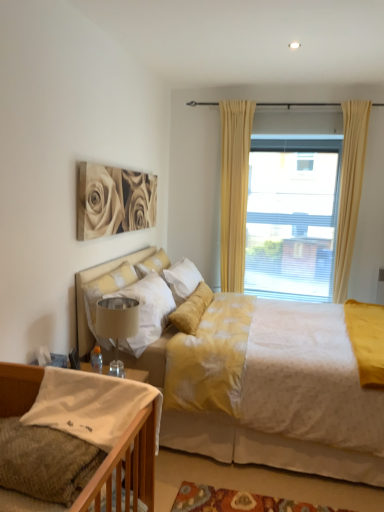
Question: Is the position of white textured bed at center, placed as the 2th bed when sorted from front to back, more distant than that of knitted fabric bed at lower left, the 1th bed when ordered from front to back?

Choices:
 (A) no
 (B) yes

Answer: (B)

Question: Is white textured bed at center, marked as the first bed in a back-to-front arrangement, facing away from knitted fabric bed at lower left, acting as the 2th bed starting from the back?

Choices:
 (A) no
 (B) yes

Answer: (A)

Question: Does white textured bed at center, placed as the 2th bed when sorted from front to back, appear on the right side of knitted fabric bed at lower left, acting as the 2th bed starting from the back?

Choices:
 (A) no
 (B) yes

Answer: (B)

Question: Is white textured bed at center, marked as the first bed in a back-to-front arrangement, facing towards knitted fabric bed at lower left, acting as the 2th bed starting from the back?

Choices:
 (A) yes
 (B) no

Answer: (B)

Question: Is knitted fabric bed at lower left, acting as the 2th bed starting from the back, located within white textured bed at center, placed as the 2th bed when sorted from front to back?

Choices:
 (A) no
 (B) yes

Answer: (A)

Question: Can you confirm if white textured bed at center, marked as the first bed in a back-to-front arrangement, is thinner than knitted fabric bed at lower left, the 1th bed when ordered from front to back?

Choices:
 (A) no
 (B) yes

Answer: (A)

Question: From the image's perspective, is translucent glass window at upper center on white soft pillow at upper left, which is the 2th pillow in front-to-back order?

Choices:
 (A) no
 (B) yes

Answer: (B)

Question: Is translucent glass window at upper center not within white soft pillow at upper left, the 2th pillow viewed from the back?

Choices:
 (A) no
 (B) yes

Answer: (B)

Question: Can you confirm if translucent glass window at upper center is thinner than white soft pillow at upper left, the 2th pillow viewed from the back?

Choices:
 (A) yes
 (B) no

Answer: (A)

Question: Is the surface of translucent glass window at upper center in direct contact with white soft pillow at upper left, the 2th pillow viewed from the back?

Choices:
 (A) yes
 (B) no

Answer: (B)

Question: Can you confirm if translucent glass window at upper center is taller than white soft pillow at upper left, which is the second pillow in bottom-to-top order?

Choices:
 (A) yes
 (B) no

Answer: (A)

Question: Can you confirm if translucent glass window at upper center is positioned to the right of white soft pillow at upper left, the 2th pillow viewed from the back?

Choices:
 (A) no
 (B) yes

Answer: (B)

Question: Is white cotton pillow at lower left, which is the 1th pillow from front to back, facing away from matte beige roses at upper left?

Choices:
 (A) yes
 (B) no

Answer: (B)